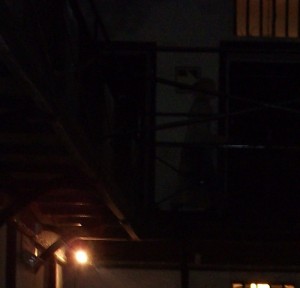
The image size is (300, 288). What are the coordinates of `door` in the screenshot? It's located at [x=133, y=67], [x=266, y=76].